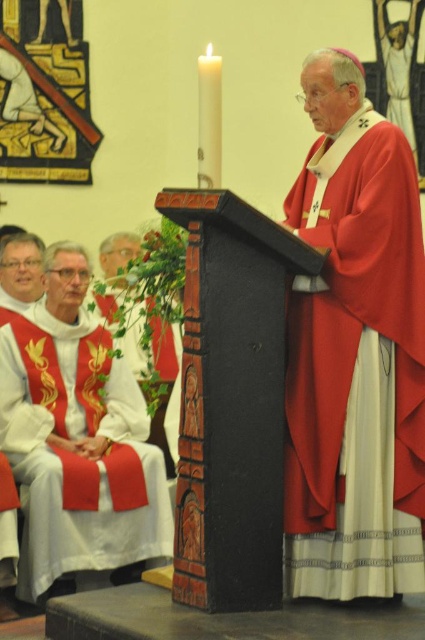
Which is more to the right, matte red fabric at center or matte red vestment at left?

Positioned to the right is matte red fabric at center.

Does matte red fabric at center have a greater width compared to matte red vestment at left?

In fact, matte red fabric at center might be narrower than matte red vestment at left.

This screenshot has height=640, width=425. Find the location of `matte red fabric at center`. matte red fabric at center is located at coordinates (357, 371).

The width and height of the screenshot is (425, 640). Find the location of `matte red fabric at center`. matte red fabric at center is located at coordinates (357, 371).